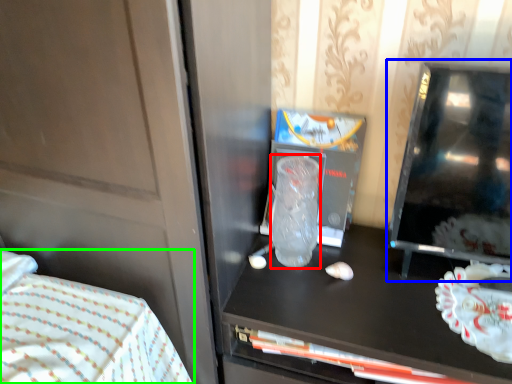
Question: Which object is positioned closest to glass vase (highlighted by a red box)? Select from appliance (highlighted by a blue box) and bed (highlighted by a green box).

Choices:
 (A) appliance
 (B) bed

Answer: (A)